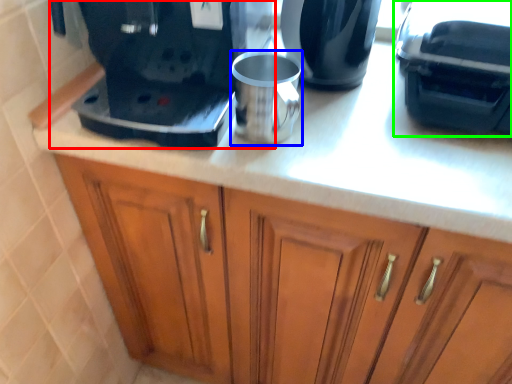
Question: Which object is the closest to the home appliance (highlighted by a red box)? Choose among these: mug (highlighted by a blue box) or coffee machine (highlighted by a green box).

Choices:
 (A) mug
 (B) coffee machine

Answer: (A)